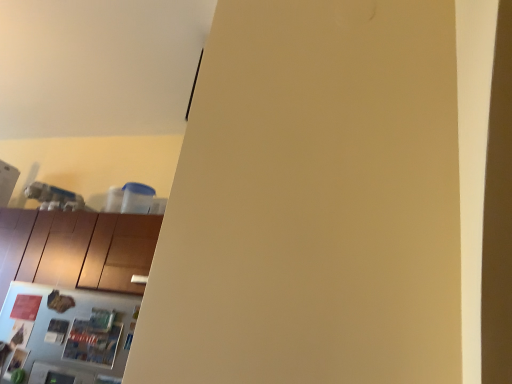
You are a GUI agent. You are given a task and a screenshot of the screen. Output one action in this format:
    pyautogui.click(x=<x>, y=<y>)
    Task: Click on the brown matte cabinet at lower left
    
    Given the screenshot: What is the action you would take?
    pyautogui.click(x=78, y=249)

What do you see at coordinates (78, 249) in the screenshot? The width and height of the screenshot is (512, 384). I see `brown matte cabinet at lower left` at bounding box center [78, 249].

Image resolution: width=512 pixels, height=384 pixels. I want to click on brown matte cabinet at lower left, so click(78, 249).